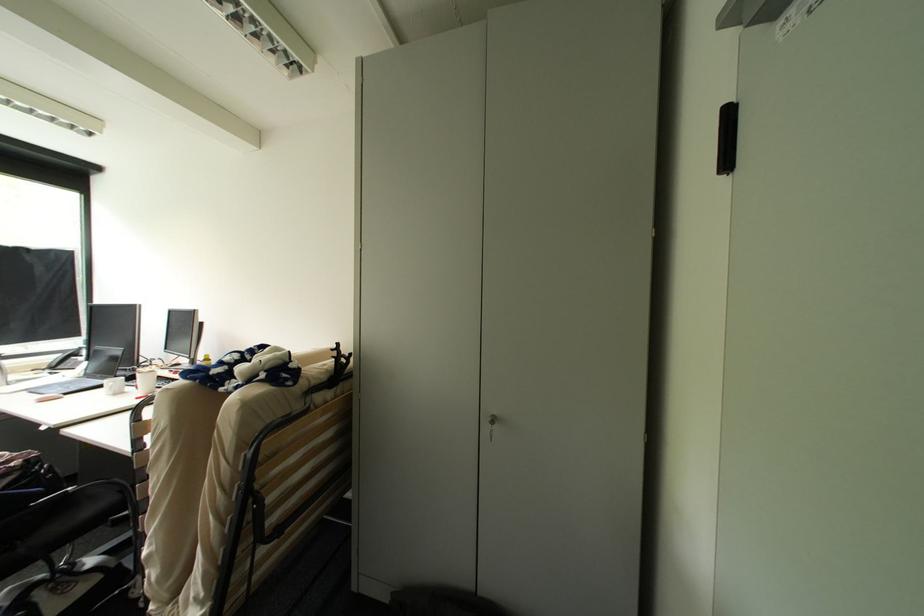
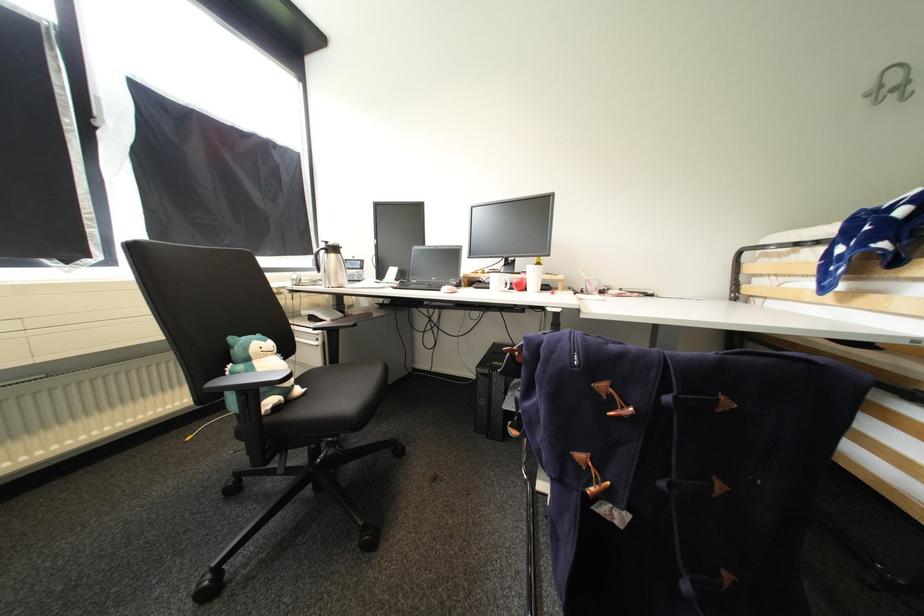
Question: What movement of the cameraman would produce the second image?

Choices:
 (A) Left
 (B) Right
 (C) Forward
 (D) Backward

Answer: (A)